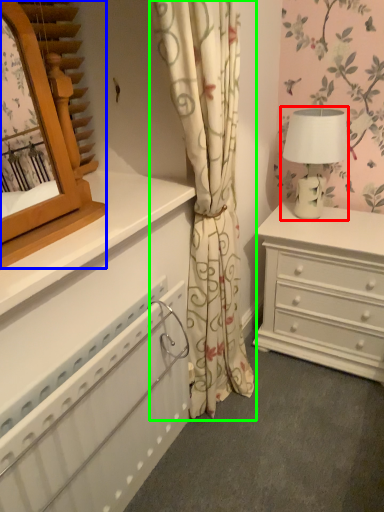
Question: Which is farther away from table lamp (highlighted by a red box)? mirror (highlighted by a blue box) or curtain (highlighted by a green box)?

Choices:
 (A) mirror
 (B) curtain

Answer: (A)